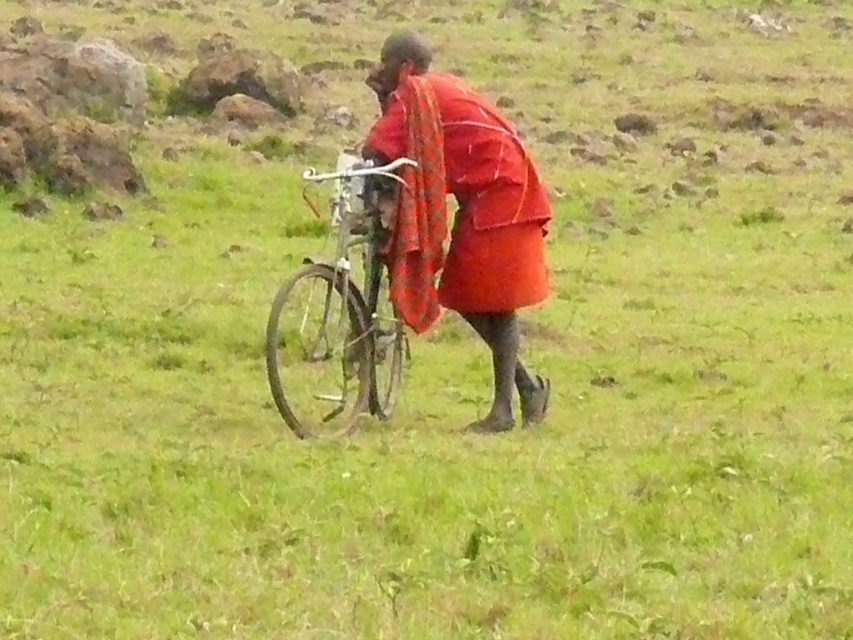
Question: Which of the following is the closest to the observer?

Choices:
 (A) silver metallic bicycle at center
 (B) red woven cloth at center

Answer: (A)

Question: Can you confirm if red woven cloth at center is thinner than silver metallic bicycle at center?

Choices:
 (A) yes
 (B) no

Answer: (B)

Question: Which point is closer to the camera?

Choices:
 (A) (498, 300)
 (B) (334, 372)

Answer: (A)

Question: Which of the following is the closest to the observer?

Choices:
 (A) (277, 317)
 (B) (514, 333)

Answer: (A)

Question: In this image, where is red woven cloth at center located relative to silver metallic bicycle at center?

Choices:
 (A) right
 (B) left

Answer: (A)

Question: Can you confirm if red woven cloth at center is positioned to the left of silver metallic bicycle at center?

Choices:
 (A) no
 (B) yes

Answer: (A)